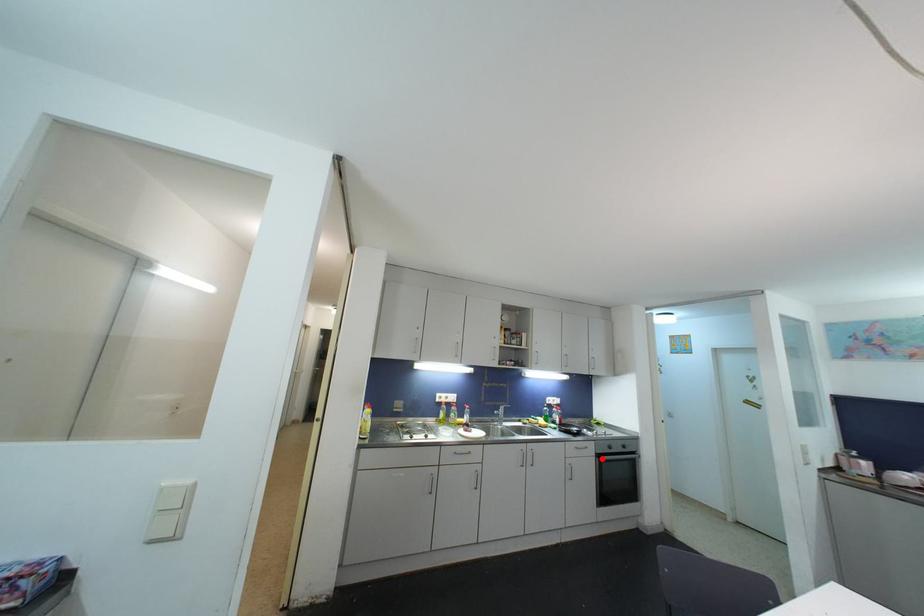
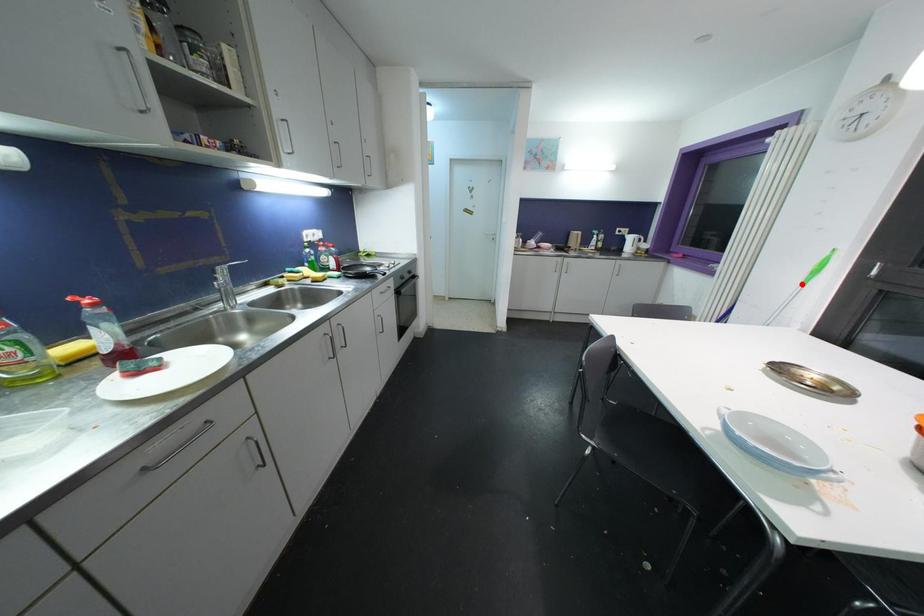
I am providing you with two images of the same scene from different viewpoints. A red point is marked on the first image and another point is marked on the second image. Is the marked point in image1 the same physical position as the marked point in image2?

No